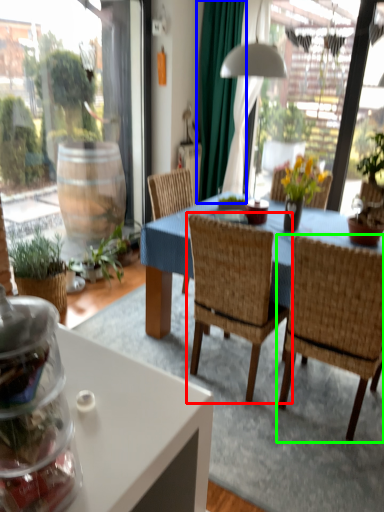
Question: Based on their relative distances, which object is nearer to chair (highlighted by a red box)? Choose from curtain (highlighted by a blue box) and chair (highlighted by a green box).

Choices:
 (A) curtain
 (B) chair

Answer: (B)